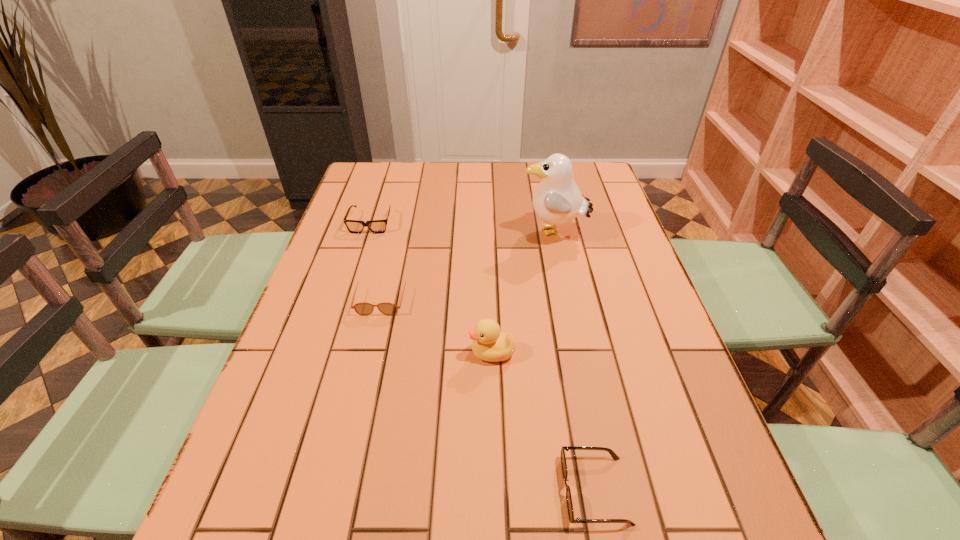
Where is `gull`? Image resolution: width=960 pixels, height=540 pixels. gull is located at coordinates (557, 200).

You are a GUI agent. You are given a task and a screenshot of the screen. Output one action in this format:
    pyautogui.click(x=<x>, y=<y>)
    Task: Click on the fourth shortest object
    
    Given the screenshot: What is the action you would take?
    pyautogui.click(x=489, y=344)

You are a GUI agent. You are given a task and a screenshot of the screen. Output one action in this format:
    pyautogui.click(x=<x>, y=<y>)
    Task: Click on the duckling
    
    Given the screenshot: What is the action you would take?
    pyautogui.click(x=489, y=344)

You are a GUI agent. You are given a task and a screenshot of the screen. Output one action in this format:
    pyautogui.click(x=<x>, y=<y>)
    Task: Click on the farthest sunglasses
    This screenshot has width=960, height=540.
    Given the screenshot: What is the action you would take?
    click(354, 226)

Where is `the second farthest sunglasses`? the second farthest sunglasses is located at coordinates (364, 309).

Where is `the nearest object`? The image size is (960, 540). the nearest object is located at coordinates (563, 459).

Locate an element on the screen. The height and width of the screenshot is (540, 960). the rightmost sunglasses is located at coordinates (563, 459).

You are a GUI agent. You are given a task and a screenshot of the screen. Output one action in this format:
    pyautogui.click(x=<x>, y=<y>)
    Task: Click on the vacant space located 0.130m on the beak of the tallest object
    This screenshot has width=960, height=540.
    Given the screenshot: What is the action you would take?
    pyautogui.click(x=477, y=233)

You are a GUI agent. You are given a task and a screenshot of the screen. Output one action in this format:
    pyautogui.click(x=<x>, y=<y>)
    Task: Click on the vacant space located 0.400m on the beak of the tallest object
    The image size is (960, 540).
    Given the screenshot: What is the action you would take?
    pyautogui.click(x=389, y=233)

This screenshot has width=960, height=540. In order to click on free space located on the beak of the tallest object in this screenshot , I will do `click(481, 233)`.